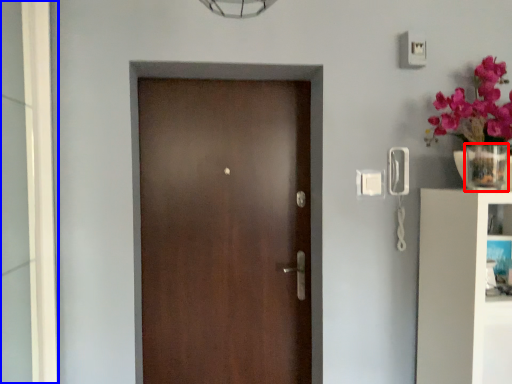
Question: Which object is further to the camera taking this photo, glass vase (highlighted by a red box) or glass door (highlighted by a blue box)?

Choices:
 (A) glass vase
 (B) glass door

Answer: (A)